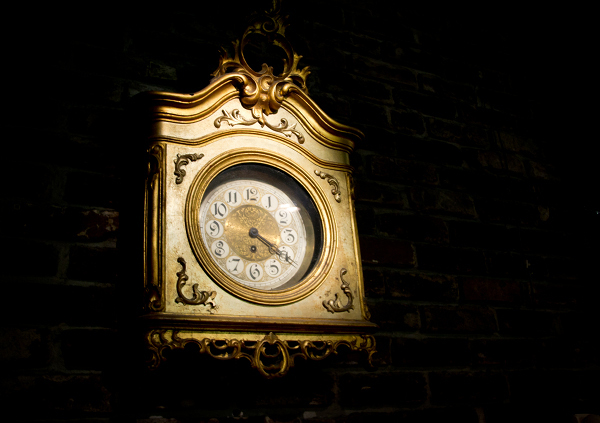
Locate an element on the screen. The height and width of the screenshot is (423, 600). raised molding around clock face is located at coordinates (196, 239).